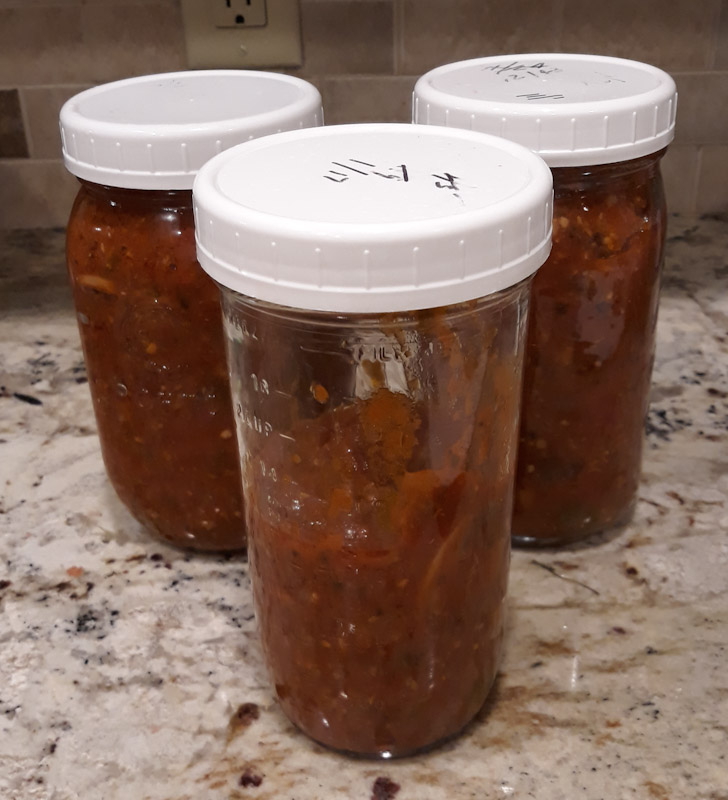
Find the location of `3 prong outlet`. 3 prong outlet is located at coordinates (282, 36).